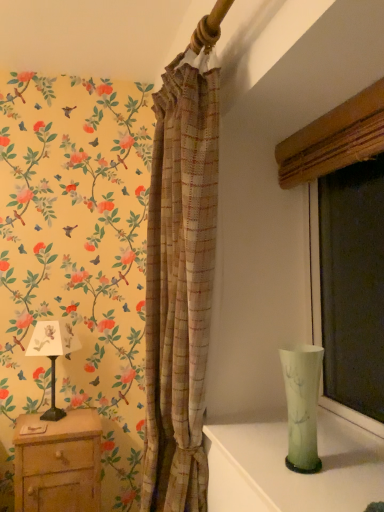
At what (x,y) coordinates should I click in order to perform the action: click on space that is in front of green translucent vase at right. Please return your answer as a coordinate pair (x, y). This screenshot has height=512, width=384. Looking at the image, I should click on [x=313, y=493].